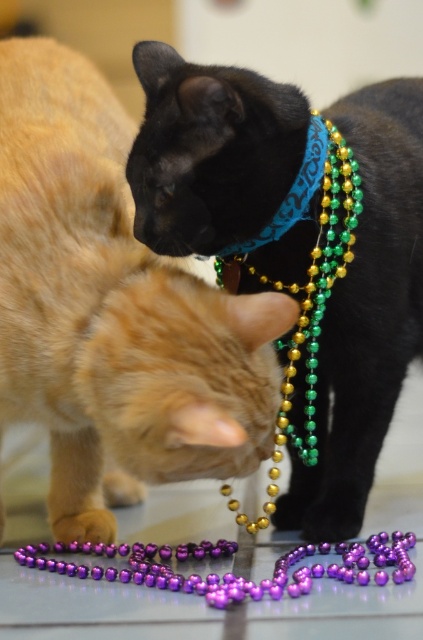
Question: Which object appears closest to the camera in this image?

Choices:
 (A) blue fabric neckband at upper center
 (B) shiny black cat at center
 (C) black matte bandana at upper center
 (D) green metallic beads at center

Answer: (B)

Question: Does shiny black cat at center have a lesser width compared to blue fabric neckband at upper center?

Choices:
 (A) yes
 (B) no

Answer: (B)

Question: From the image, what is the correct spatial relationship of black matte bandana at upper center in relation to green metallic beads at center?

Choices:
 (A) below
 (B) above

Answer: (B)

Question: Which of the following is the closest to the observer?

Choices:
 (A) blue fabric neckband at upper center
 (B) black matte bandana at upper center
 (C) shiny black cat at center
 (D) green metallic beads at center

Answer: (C)

Question: Which object is farther from the camera taking this photo?

Choices:
 (A) black matte bandana at upper center
 (B) green metallic beads at center

Answer: (B)

Question: Considering the relative positions of shiny black cat at center and blue fabric neckband at upper center in the image provided, where is shiny black cat at center located with respect to blue fabric neckband at upper center?

Choices:
 (A) left
 (B) right

Answer: (A)